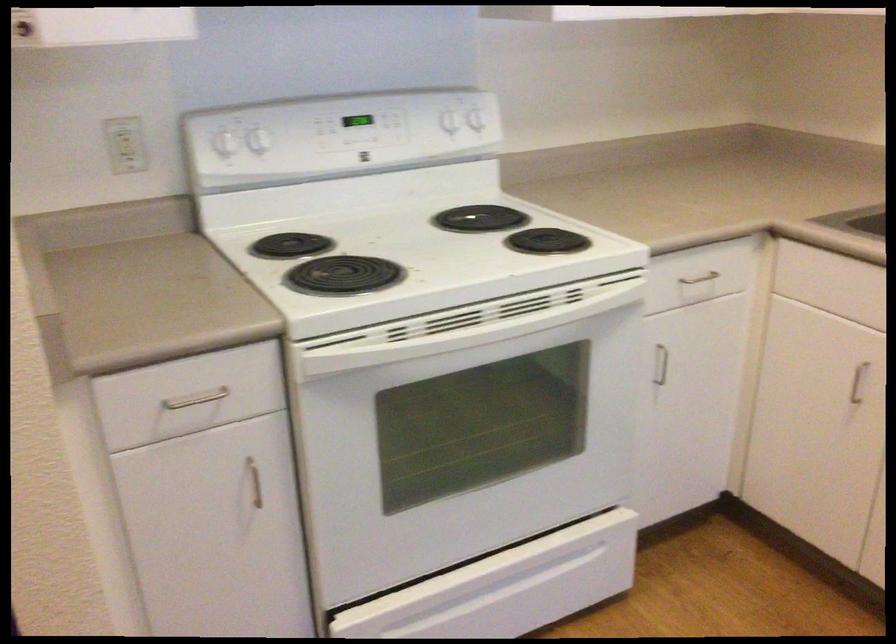
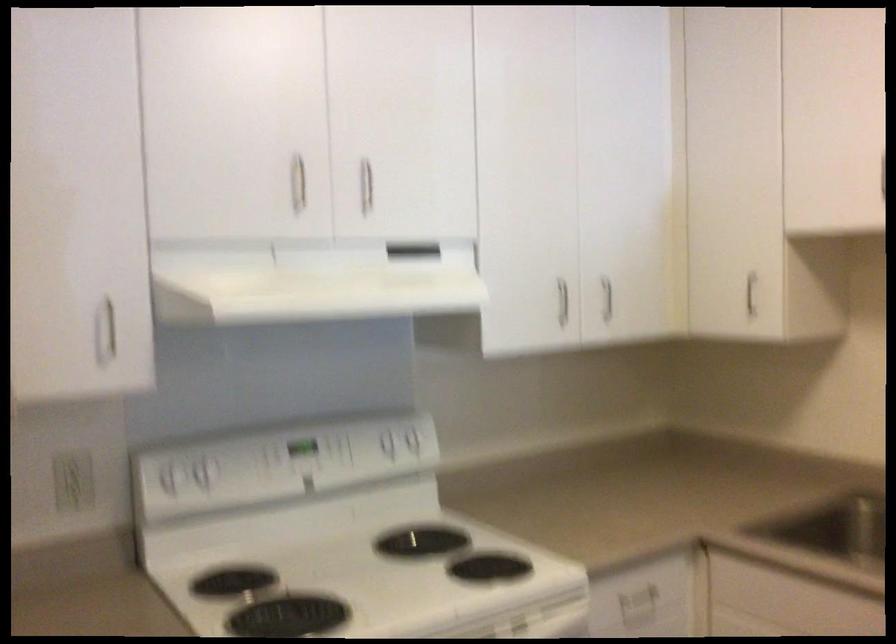
Question: The images are taken continuously from a first-person perspective. In which direction is your viewpoint rotating?

Choices:
 (A) Left
 (B) Right
 (C) Up
 (D) Down

Answer: (C)